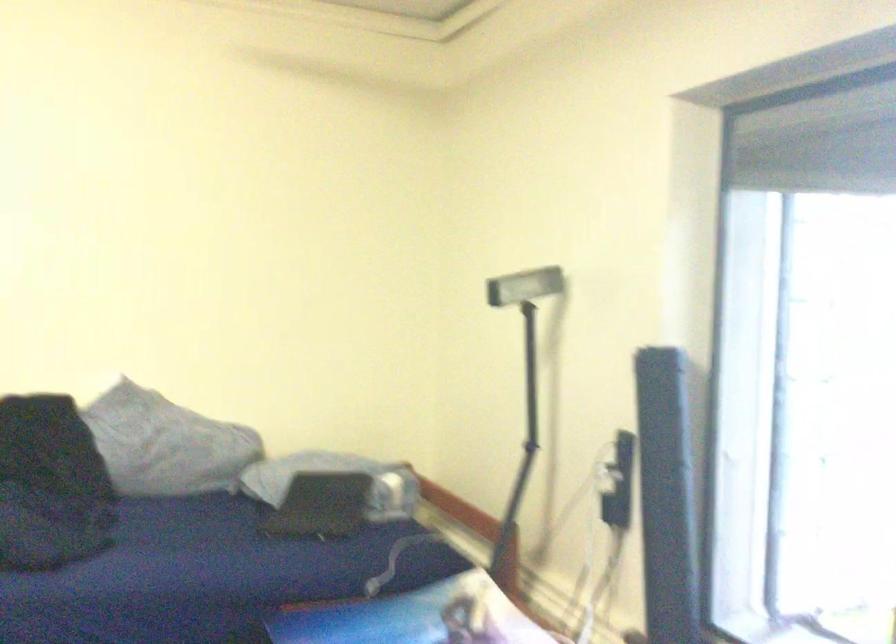
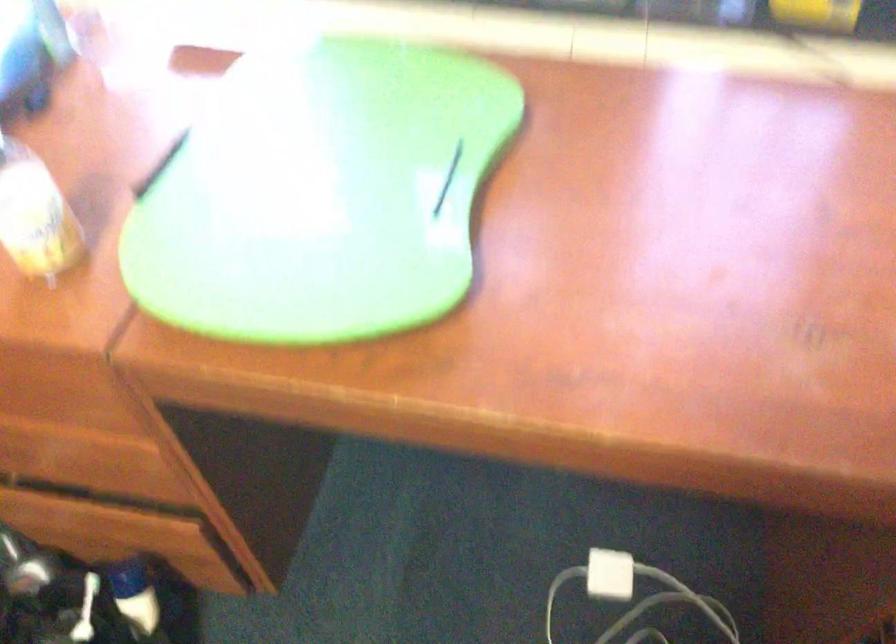
The first image is from the beginning of the video and the second image is from the end. How did the camera likely rotate when shooting the video?

The camera's rotation is toward right-down.